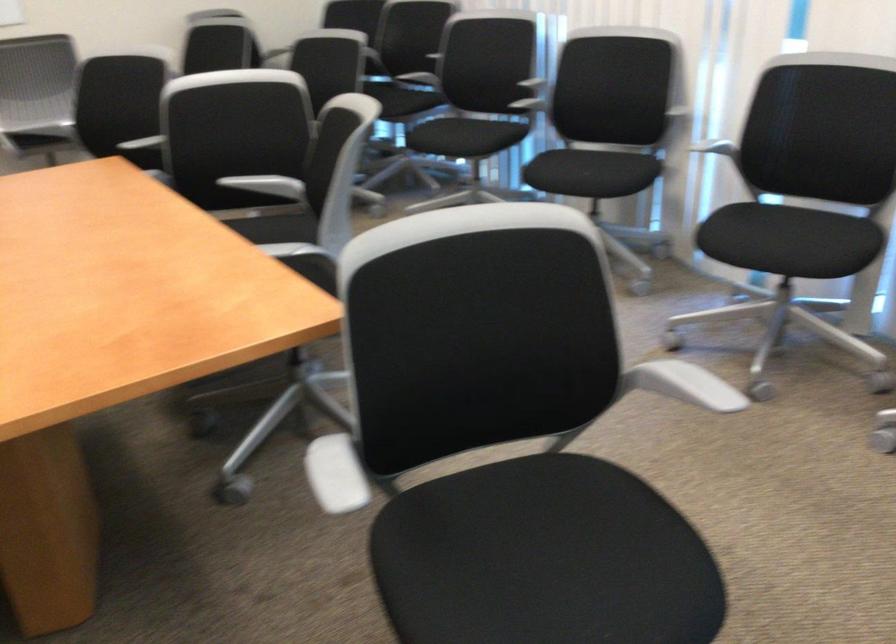
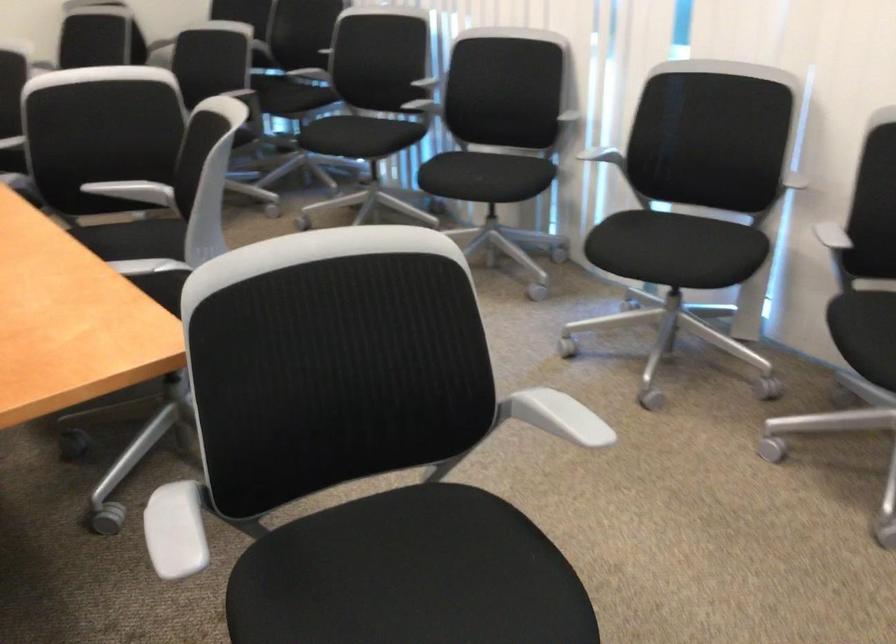
Question: Based on the continuous images, in which direction is the camera rotating? Reply with the corresponding letter.

Choices:
 (A) Left
 (B) Right
 (C) Up
 (D) Down

Answer: (B)